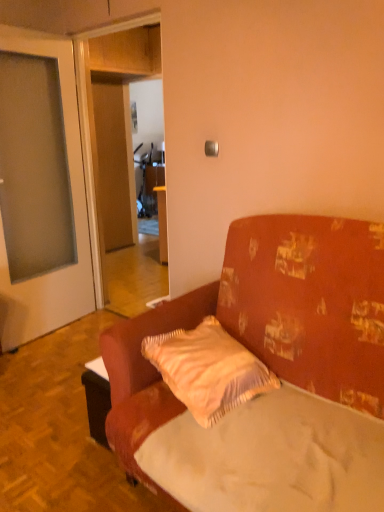
Question: Is light beige textured pillow at center inside the boundaries of white fabric mattress at center, or outside?

Choices:
 (A) outside
 (B) inside

Answer: (A)

Question: Looking at their shapes, would you say light beige textured pillow at center is wider or thinner than white fabric mattress at center?

Choices:
 (A) thin
 (B) wide

Answer: (A)

Question: Which is nearer to the white fabric mattress at center?

Choices:
 (A) light beige textured pillow at center
 (B) textured fabric couch at center

Answer: (B)

Question: Which of these objects is positioned closest to the light beige textured pillow at center?

Choices:
 (A) textured fabric couch at center
 (B) white fabric mattress at center

Answer: (A)